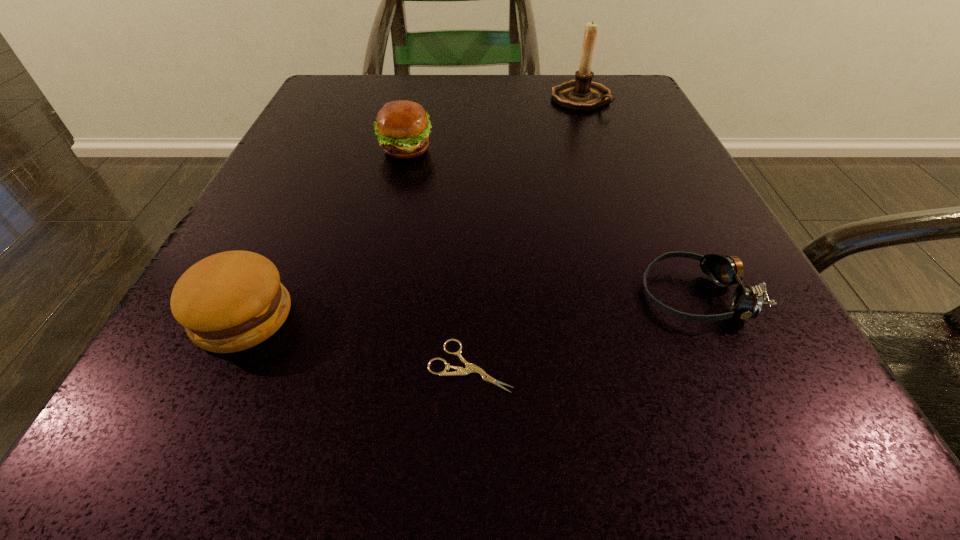
At what (x,y) coordinates should I click in order to perform the action: click on vacant position located 0.250m on the right of the fourth nearest object. Please return your answer as a coordinate pair (x, y). The height and width of the screenshot is (540, 960). Looking at the image, I should click on (585, 150).

At what (x,y) coordinates should I click in order to perform the action: click on vacant area situated 0.220m on the right of the nearer hamburger. Please return your answer as a coordinate pair (x, y). Looking at the image, I should click on (490, 316).

Identify the location of free region located 0.350m through the lenses of the goggles. (341, 295).

Find the location of a particular element. This screenshot has height=540, width=960. vacant area situated through the lenses of the goggles is located at coordinates (393, 295).

Where is `vacant space situated 0.270m through the lenses of the goggles`? vacant space situated 0.270m through the lenses of the goggles is located at coordinates (410, 295).

The width and height of the screenshot is (960, 540). Identify the location of blank area located on the left of the shortest object. (289, 366).

Find the location of a particular element. The image size is (960, 540). object positioned at the far edge is located at coordinates (581, 94).

Locate an element on the screen. candle holder that is at the right edge is located at coordinates (581, 94).

Find the location of `goggles positioned at the right edge`. goggles positioned at the right edge is located at coordinates (746, 302).

This screenshot has height=540, width=960. What are the coordinates of `object located at the far right corner` in the screenshot? It's located at (581, 94).